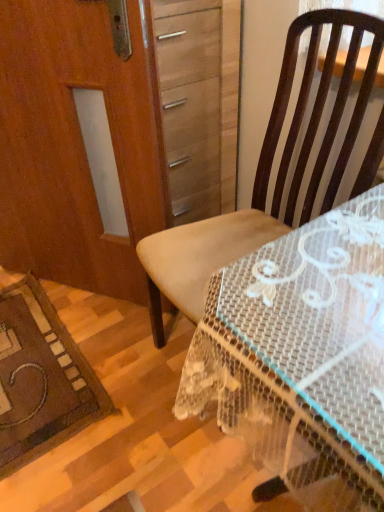
The height and width of the screenshot is (512, 384). What do you see at coordinates (267, 170) in the screenshot?
I see `brown fabric chair at center` at bounding box center [267, 170].

What is the approximate width of brown fabric chair at center?

It is 22.94 inches.

This screenshot has width=384, height=512. In order to click on clear plastic table at center in this screenshot , I will do `click(301, 351)`.

Find the location of a particular element. The height and width of the screenshot is (512, 384). brown fabric chair at center is located at coordinates (267, 170).

Consider the image. From a real-world perspective, is brown fabric chair at center under wooden screen door at left?

Indeed, from a real-world perspective, brown fabric chair at center is positioned beneath wooden screen door at left.

Who is bigger, brown fabric chair at center or wooden screen door at left?

Bigger between the two is brown fabric chair at center.

Considering the sizes of objects brown fabric chair at center and wooden screen door at left in the image provided, who is wider, brown fabric chair at center or wooden screen door at left?

brown fabric chair at center.

Measure the distance from brown fabric chair at center to wooden screen door at left.

They are 40.40 centimeters apart.

Are clear plastic table at center and brown fabric chair at center beside each other?

No, clear plastic table at center is not with brown fabric chair at center.

Is point (330, 225) closer to camera compared to point (321, 163)?

Yes, it is.

Based on the photo, from a real-world perspective, who is located higher, clear plastic table at center or brown fabric chair at center?

In real-world perspective, brown fabric chair at center is above.

Would you say clear plastic table at center is to the left or to the right of brown fabric chair at center in the picture?

Based on their positions, clear plastic table at center is located to the right of brown fabric chair at center.

Which object is closer to the camera taking this photo, wooden screen door at left or brown fabric chair at center?

brown fabric chair at center is more forward.

From the image's perspective, which one is positioned lower, wooden screen door at left or brown fabric chair at center?

brown fabric chair at center, from the image's perspective.

Considering the positions of objects wooden screen door at left and brown fabric chair at center in the image provided, who is more to the left, wooden screen door at left or brown fabric chair at center?

wooden screen door at left is more to the left.

Considering the positions of objects brown fabric chair at center and clear plastic table at center in the image provided, who is in front, brown fabric chair at center or clear plastic table at center?

clear plastic table at center.

Would you say brown fabric chair at center is a long distance from clear plastic table at center?

brown fabric chair at center is near clear plastic table at center, not far away.

What's the angular difference between brown fabric chair at center and clear plastic table at center's facing directions?

The angular difference between brown fabric chair at center and clear plastic table at center is 0.376 degrees.

From a real-world perspective, is brown fabric chair at center located higher than clear plastic table at center?

Correct, in the physical world, brown fabric chair at center is higher than clear plastic table at center.

Is wooden screen door at left located within clear plastic table at center?

No, clear plastic table at center does not contain wooden screen door at left.

Which of these two, clear plastic table at center or wooden screen door at left, is bigger?

clear plastic table at center is bigger.

From a real-world perspective, which is physically below, clear plastic table at center or wooden screen door at left?

From a 3D spatial view, clear plastic table at center is below.

From the image's perspective, relative to clear plastic table at center, is wooden screen door at left above or below?

Based on their image positions, wooden screen door at left is located above clear plastic table at center.

Which point is more forward, (89,223) or (280,302)?

The point (280,302) is more forward.

Where is `desk located on the right of wooden screen door at left`? Image resolution: width=384 pixels, height=512 pixels. desk located on the right of wooden screen door at left is located at coordinates (301, 351).

Where is `screen door above the brown fabric chair at center (from the image's perspective)`? The width and height of the screenshot is (384, 512). screen door above the brown fabric chair at center (from the image's perspective) is located at coordinates (73, 145).

Find the location of a particular element. The height and width of the screenshot is (512, 384). chair behind the clear plastic table at center is located at coordinates (267, 170).

Based on their spatial positions, is clear plastic table at center or wooden screen door at left further from brown fabric chair at center?

wooden screen door at left.

From the image, which object appears to be nearer to brown fabric chair at center, wooden screen door at left or clear plastic table at center?

clear plastic table at center.

Based on their spatial positions, is brown fabric chair at center or wooden screen door at left further from clear plastic table at center?

The object further to clear plastic table at center is wooden screen door at left.

Looking at the image, which one is located closer to clear plastic table at center, wooden screen door at left or brown fabric chair at center?

brown fabric chair at center.

Considering their positions, is clear plastic table at center positioned closer to wooden screen door at left than brown fabric chair at center?

brown fabric chair at center is closer to wooden screen door at left.

Looking at the image, which one is located closer to wooden screen door at left, brown fabric chair at center or clear plastic table at center?

brown fabric chair at center is positioned closer to the anchor wooden screen door at left.

Locate an element on the screen. The height and width of the screenshot is (512, 384). chair located between wooden screen door at left and clear plastic table at center in the left-right direction is located at coordinates (267, 170).